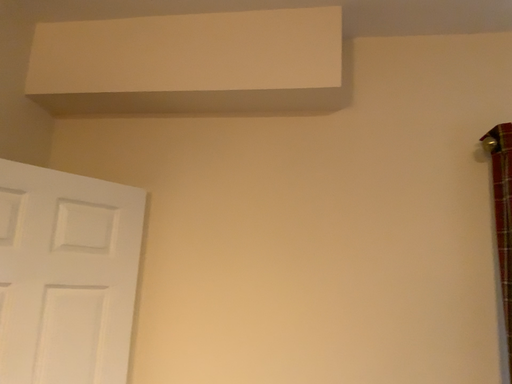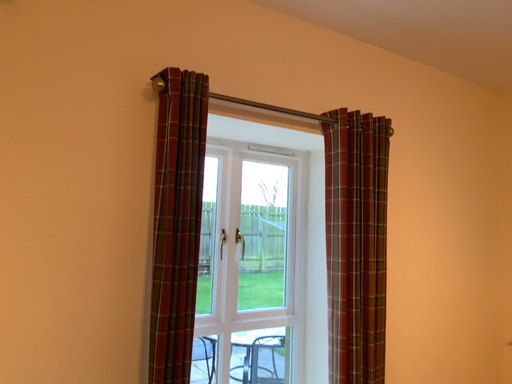
Question: Which way did the camera rotate in the video?

Choices:
 (A) rotated right
 (B) rotated left

Answer: (A)